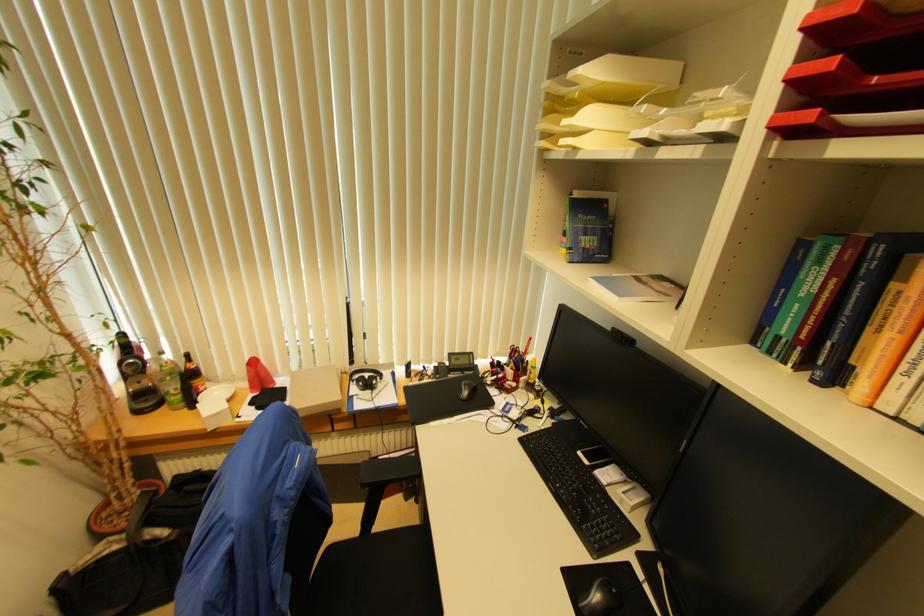
The height and width of the screenshot is (616, 924). What do you see at coordinates (377, 576) in the screenshot?
I see `the chair sitting surface` at bounding box center [377, 576].